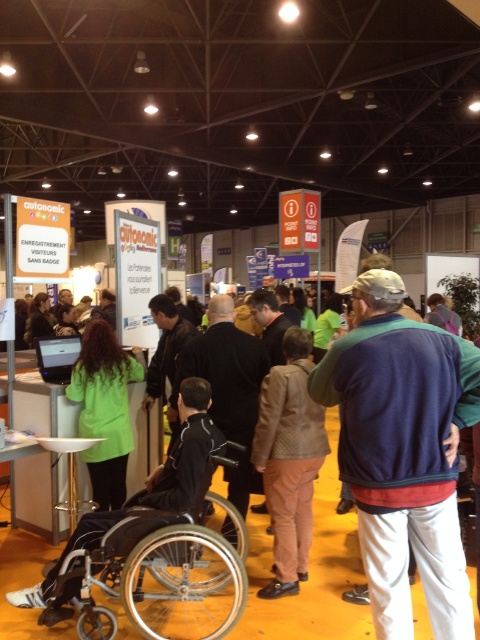
Between silver metallic wheelchair at lower left and dark blue jacket at center, which one has less height?

dark blue jacket at center is shorter.

Where is `silver metallic wheelchair at lower left`? This screenshot has height=640, width=480. silver metallic wheelchair at lower left is located at coordinates click(158, 577).

Does point (152, 532) lie behind point (115, 356)?

That is False.

Where is `silver metallic wheelchair at lower left`? silver metallic wheelchair at lower left is located at coordinates (158, 577).

Which is above, dark blue jacket at center or green matte jacket at center?

green matte jacket at center is higher up.

Is dark blue jacket at center thinner than green matte jacket at center?

No.

At what (x,y) coordinates should I click in order to perform the action: click on dark blue jacket at center. Please return your answer as a coordinate pair (x, y). This screenshot has width=480, height=640. Looking at the image, I should click on (311, 572).

At what (x,y) coordinates should I click in order to perform the action: click on dark blue jacket at center. Please return your answer as a coordinate pair (x, y). The width and height of the screenshot is (480, 640). Looking at the image, I should click on (311, 572).